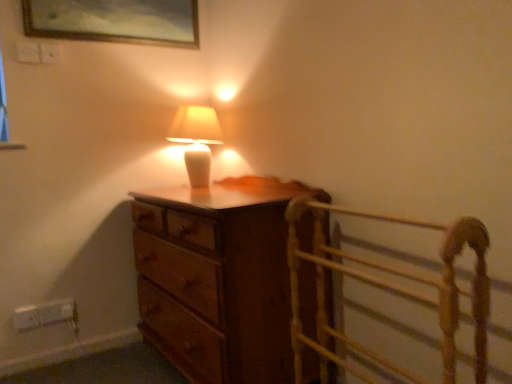
Question: Does matte white lamp at center have a lesser height compared to white plastic electric outlet at lower left, arranged as the second electric outlet when viewed from the left?

Choices:
 (A) yes
 (B) no

Answer: (B)

Question: Is matte white lamp at center outside of white plastic electric outlet at lower left, arranged as the second electric outlet when viewed from the left?

Choices:
 (A) no
 (B) yes

Answer: (B)

Question: Is matte white lamp at center touching white plastic electric outlet at lower left, arranged as the second electric outlet when viewed from the left?

Choices:
 (A) no
 (B) yes

Answer: (A)

Question: Can you confirm if matte white lamp at center is wider than white plastic electric outlet at lower left, positioned as the 1th electric outlet in right-to-left order?

Choices:
 (A) no
 (B) yes

Answer: (B)

Question: Considering the relative sizes of matte white lamp at center and white plastic electric outlet at lower left, positioned as the 1th electric outlet in right-to-left order, in the image provided, is matte white lamp at center thinner than white plastic electric outlet at lower left, positioned as the 1th electric outlet in right-to-left order,?

Choices:
 (A) yes
 (B) no

Answer: (B)

Question: Considering the relative positions of matte white lamp at center and white plastic electric outlet at lower left, arranged as the second electric outlet when viewed from the left, in the image provided, is matte white lamp at center behind white plastic electric outlet at lower left, arranged as the second electric outlet when viewed from the left,?

Choices:
 (A) no
 (B) yes

Answer: (A)

Question: Does wooden chest of drawers at center lie in front of wooden bed frame at right?

Choices:
 (A) yes
 (B) no

Answer: (B)

Question: From the image's perspective, is wooden chest of drawers at center beneath wooden bed frame at right?

Choices:
 (A) no
 (B) yes

Answer: (A)

Question: Can you confirm if wooden chest of drawers at center is wider than wooden bed frame at right?

Choices:
 (A) yes
 (B) no

Answer: (A)

Question: Is wooden bed frame at right a part of wooden chest of drawers at center?

Choices:
 (A) no
 (B) yes

Answer: (A)

Question: Is wooden chest of drawers at center facing away from wooden bed frame at right?

Choices:
 (A) yes
 (B) no

Answer: (B)

Question: Is wooden chest of drawers at center taller than wooden bed frame at right?

Choices:
 (A) no
 (B) yes

Answer: (B)

Question: Would you say wooden bed frame at right is part of white plastic electric outlet at lower left, positioned as the 1th electric outlet in right-to-left order,'s contents?

Choices:
 (A) yes
 (B) no

Answer: (B)